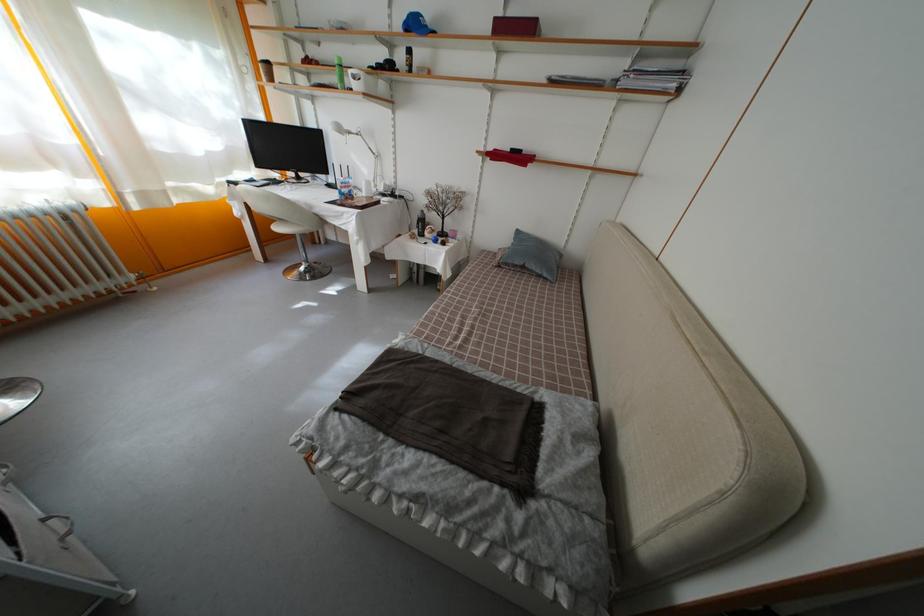
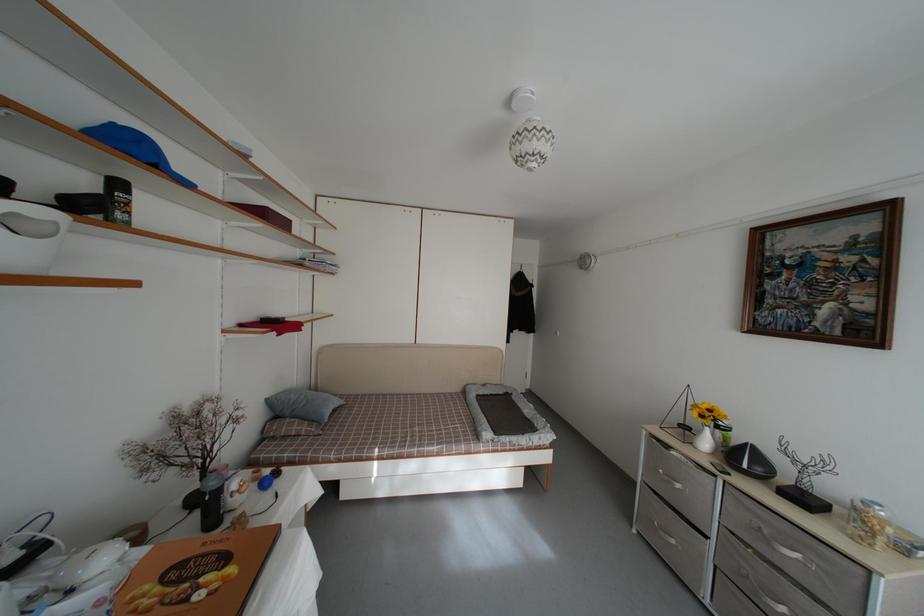
The point at [516,276] is marked in the first image. Where is the corresponding point in the second image?

(332, 431)